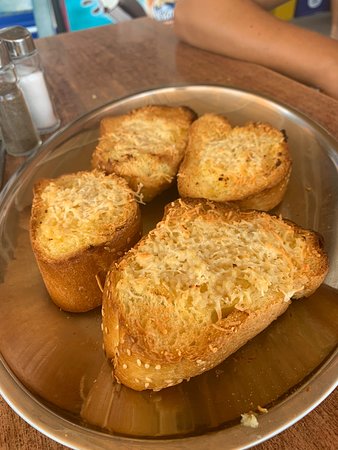
Where is `tray`? tray is located at coordinates (45, 351).